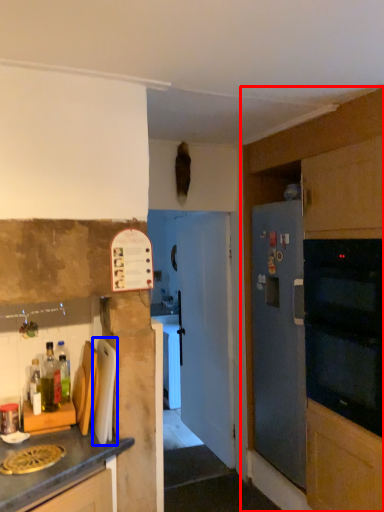
Question: Which object is closer to the camera taking this photo, cabinetry (highlighted by a red box) or appliance (highlighted by a blue box)?

Choices:
 (A) cabinetry
 (B) appliance

Answer: (B)